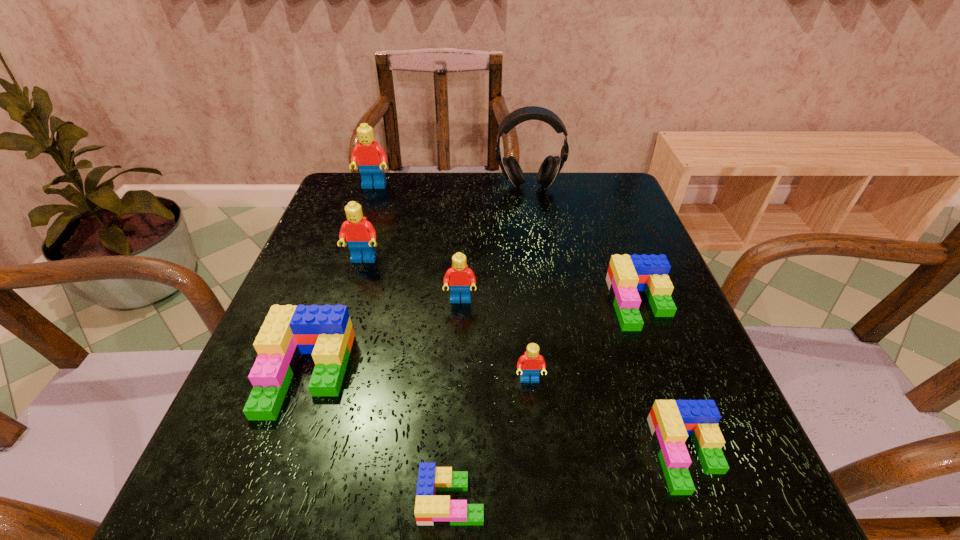
You are a GUI agent. You are given a task and a screenshot of the screen. Output one action in this format:
    pyautogui.click(x=<x>, y=<y>)
    Task: Click on the vacant space that is in between the eighth tallest object and the black earphone
    The width and height of the screenshot is (960, 540).
    Given the screenshot: What is the action you would take?
    pyautogui.click(x=608, y=320)

Where is `unoccupied position between the sixth tallest Lego and the earphone`? The height and width of the screenshot is (540, 960). unoccupied position between the sixth tallest Lego and the earphone is located at coordinates (585, 245).

Where is `vacant space in between the farthest red Lego and the shortest object`? The width and height of the screenshot is (960, 540). vacant space in between the farthest red Lego and the shortest object is located at coordinates (413, 343).

The width and height of the screenshot is (960, 540). What are the coordinates of `free space between the shortest Lego and the farthest Lego` in the screenshot? It's located at (413, 343).

This screenshot has width=960, height=540. I want to click on object that is the closest to the biggest red Lego, so point(360,234).

Identify which object is located as the third nearest to the farthest Lego. Please provide its 2D coordinates. Your answer should be formatted as a tuple, i.e. [(x, y)], where the tuple contains the x and y coordinates of a point satisfying the conditions above.

[(461, 278)]

Find the location of a particular element. This screenshot has width=960, height=540. the second closest Lego to the earphone is located at coordinates (627, 274).

Identify which Lego is the closest to the third shortest object. Please provide its 2D coordinates. Your answer should be formatted as a tuple, i.e. [(x, y)], where the tuple contains the x and y coordinates of a point satisfying the conditions above.

[(671, 422)]

This screenshot has height=540, width=960. Find the location of `red Lego that is the closest to the seventh nearest object`. red Lego that is the closest to the seventh nearest object is located at coordinates (461, 278).

Locate which red Lego is the third closest to the nearest red Lego. Please provide its 2D coordinates. Your answer should be formatted as a tuple, i.e. [(x, y)], where the tuple contains the x and y coordinates of a point satisfying the conditions above.

[(370, 157)]